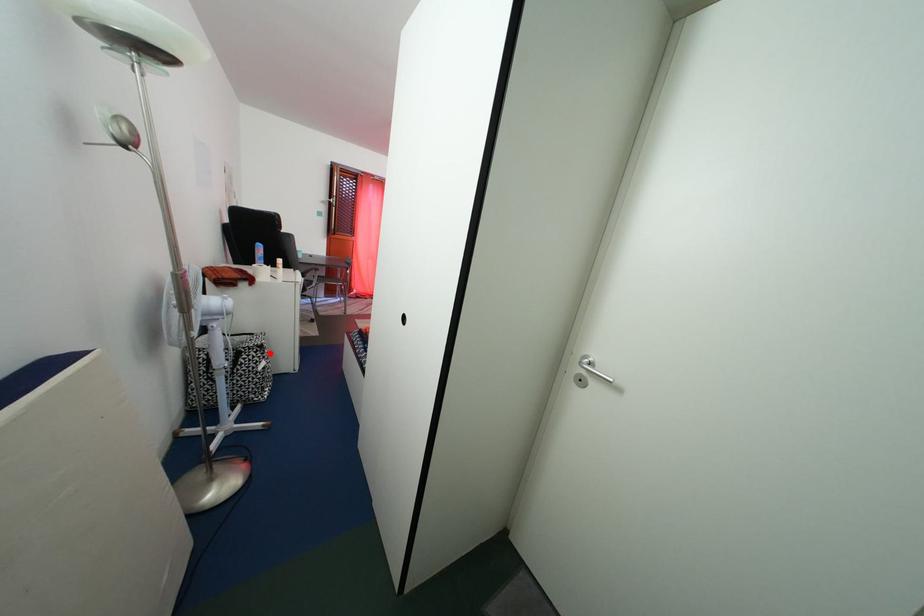
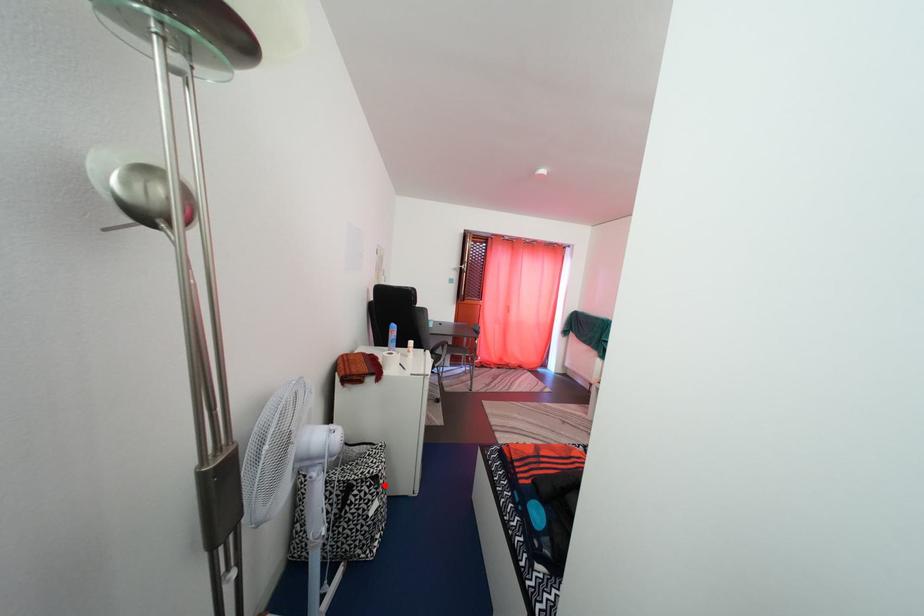
Based on the photo, I am providing you with two images of the same scene from different viewpoints. A red point is marked on the first image and another point is marked on the second image. Are the points marked in image1 and image2 representing the same 3D position?

Yes